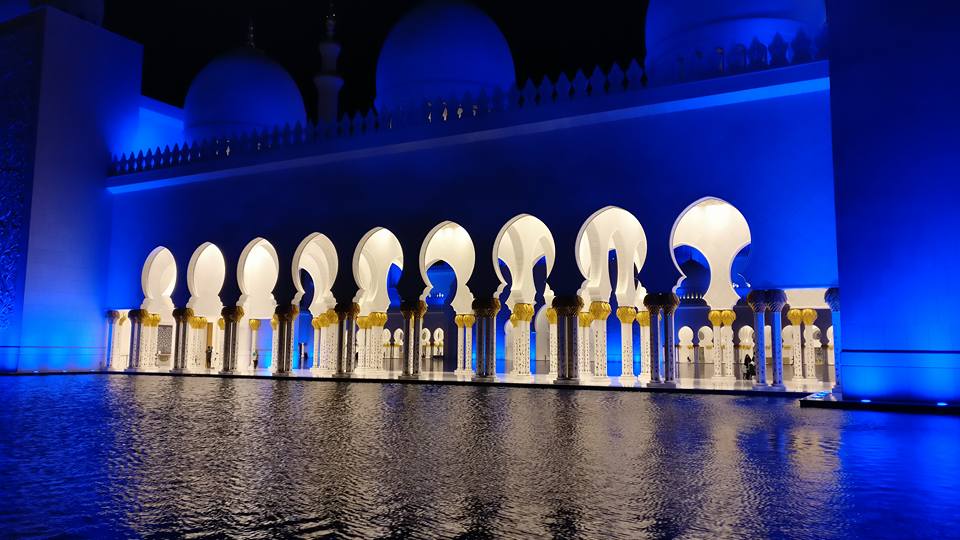
Identify the location of pillars. (632, 342), (596, 350).